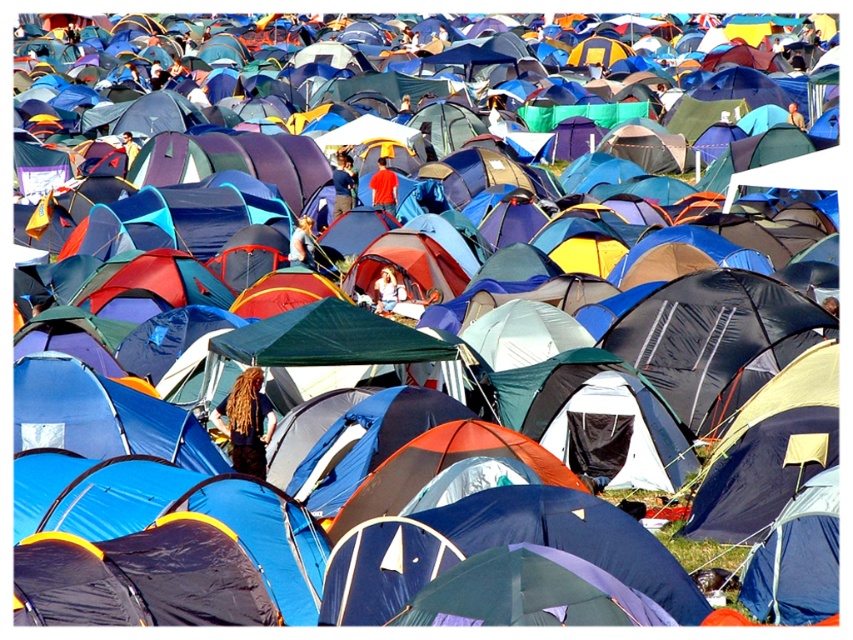
You are a photographer at the festival and want to capture both the matte red shirt at center and the light brown hair at center in a single shot. Which object should you focus on first to ensure both are in focus?

You should focus on the matte red shirt at center first because it is closer to the viewer than the light brown hair at center, so focusing on the closer object will help both be in focus.

You are a photographer trying to capture a clear shot of the dark brown hair at center and the red fabric tent at center. Which object would appear narrower in your photo?

The dark brown hair at center is thinner than the red fabric tent at center, so it would appear narrower in the photo.

You are a photographer at the festival and want to capture a photo that includes both the light blue fabric tent at center and the dark brown hair at center. Since you want the tent to appear bigger in the photo than the person, which object should you focus on to ensure proper framing?

The light blue fabric tent at center is larger in size than the dark brown hair at center, so focusing on the light blue fabric tent at center will help ensure it appears bigger in the photo.